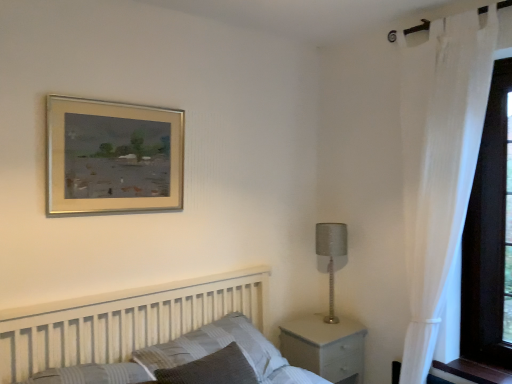
This screenshot has width=512, height=384. What are the coordinates of `free space above white matte nightstand at lower right (from a real-world perspective)` in the screenshot? It's located at (316, 327).